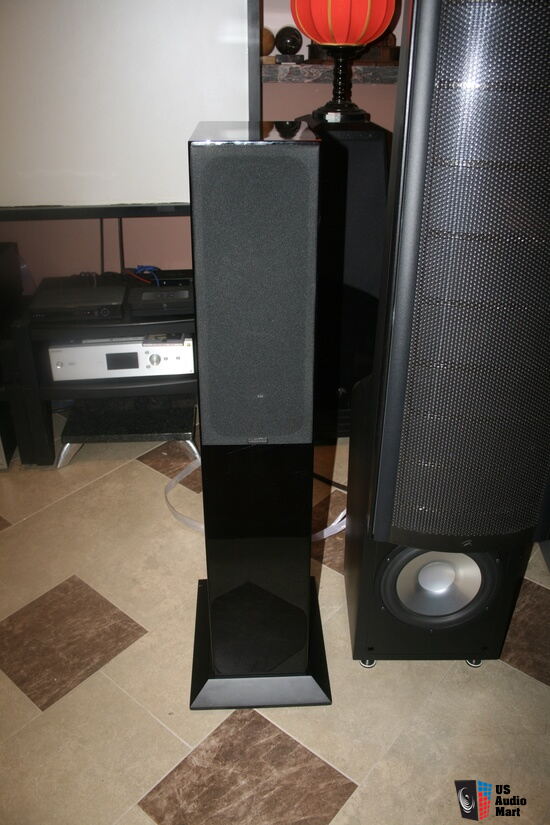
You are a GUI agent. You are given a task and a screenshot of the screen. Output one action in this format:
    pyautogui.click(x=<x>, y=<y>)
    Task: Click on the beige tiles
    This screenshot has width=550, height=825.
    Given the screenshot: What is the action you would take?
    pyautogui.click(x=71, y=761), pyautogui.click(x=95, y=521), pyautogui.click(x=164, y=658), pyautogui.click(x=431, y=780), pyautogui.click(x=383, y=722)